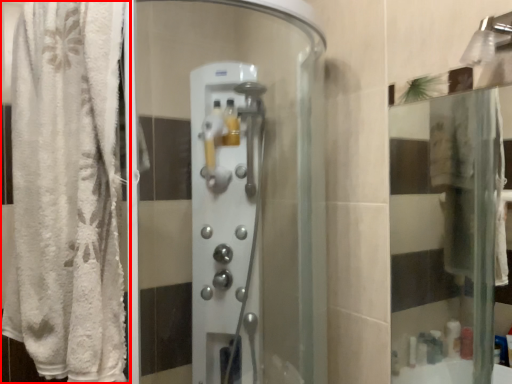
Question: In this image, where is curtain (annotated by the red box) located relative to screen door?

Choices:
 (A) right
 (B) left

Answer: (B)